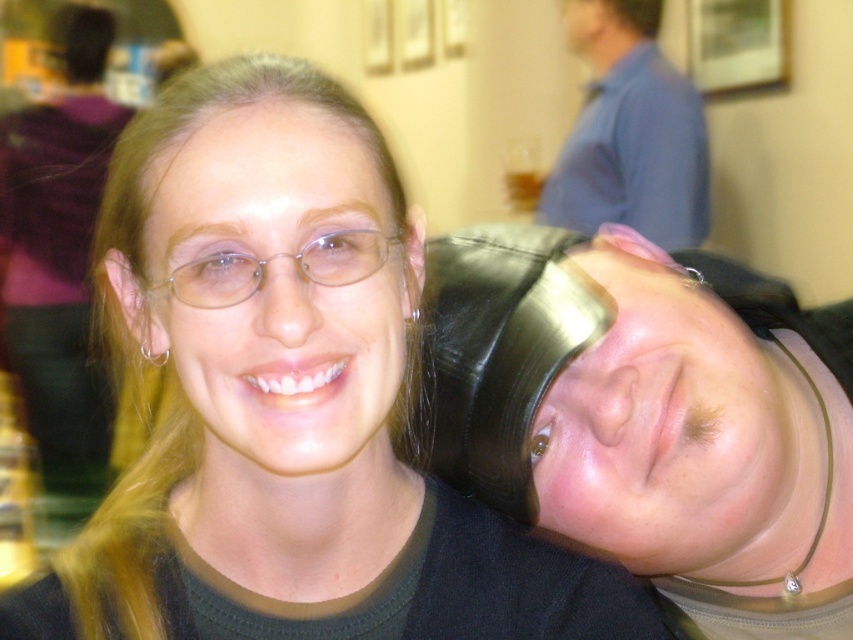
Which is in front, point (335, 170) or point (573, 195)?

Positioned in front is point (335, 170).

Based on the photo, is matte black hair at center behind blue shirt at upper center?

No, it is not.

Is point (392, 474) behind point (564, 141)?

No, (392, 474) is in front of (564, 141).

Where is `matte black hair at center`? matte black hair at center is located at coordinates (287, 401).

Between blue shirt at upper center and clear plastic glasses at upper center, which one appears on the left side from the viewer's perspective?

Positioned to the left is clear plastic glasses at upper center.

How much distance is there between blue shirt at upper center and clear plastic glasses at upper center?

A distance of 2.26 meters exists between blue shirt at upper center and clear plastic glasses at upper center.

From the picture: Who is more distant from viewer, (701,179) or (146,291)?

The point (701,179) is behind.

Find the location of a particular element. This screenshot has width=853, height=640. blue shirt at upper center is located at coordinates (630, 132).

Who is positioned more to the right, matte black hair at center or black leather hat at right?

Positioned to the right is black leather hat at right.

This screenshot has width=853, height=640. I want to click on matte black hair at center, so click(287, 401).

This screenshot has height=640, width=853. Identify the location of matte black hair at center. (287, 401).